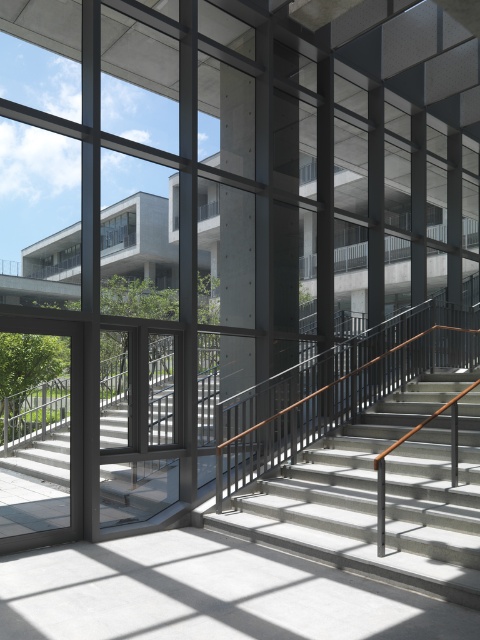
Does concrete at center appear under clear glass window at upper left?

Yes.

Which is in front, point (253, 248) or point (128, 216)?

Positioned in front is point (253, 248).

Does point (240, 323) lie behind point (127, 244)?

No, it is not.

Identify the location of concrete at center. (237, 257).

Does concrete stairs at center have a greater height compared to concrete at center?

Indeed, concrete stairs at center has a greater height compared to concrete at center.

Does concrete stairs at center come in front of concrete at center?

No, it is not.

Which is in front, point (104, 476) or point (220, 74)?

Point (220, 74) is in front.

Find the location of a particular element. The height and width of the screenshot is (640, 480). concrete stairs at center is located at coordinates (41, 440).

The width and height of the screenshot is (480, 640). What do you see at coordinates (41, 440) in the screenshot? I see `concrete stairs at center` at bounding box center [41, 440].

Who is shorter, concrete stairs at center or clear glass window at upper left?

clear glass window at upper left is shorter.

Find the location of `concrete stairs at center`. concrete stairs at center is located at coordinates (41, 440).